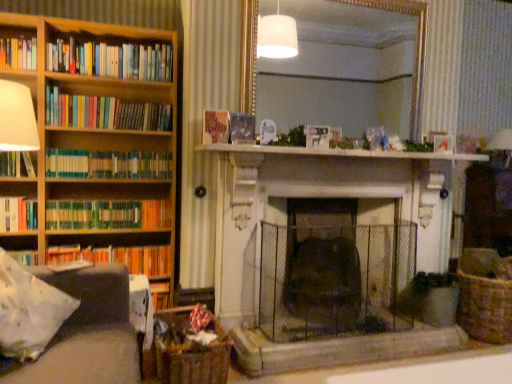
Question: Does wooden book at center, the 6th book in the bottom-to-top sequence, come in front of green matte bookshelf at left, placed as the fifth book when sorted from top to bottom?

Choices:
 (A) no
 (B) yes

Answer: (B)

Question: Does wooden book at center, the 6th book in the bottom-to-top sequence, have a greater width compared to green matte bookshelf at left, placed as the fifth book when sorted from top to bottom?

Choices:
 (A) no
 (B) yes

Answer: (A)

Question: From the image's perspective, is wooden book at center, acting as the 3th book starting from the top, beneath green matte bookshelf at left, placed as the fifth book when sorted from top to bottom?

Choices:
 (A) no
 (B) yes

Answer: (A)

Question: Is wooden book at center, acting as the 3th book starting from the top, with green matte bookshelf at left, placed as the fifth book when sorted from top to bottom?

Choices:
 (A) yes
 (B) no

Answer: (B)

Question: Is wooden book at center, the 6th book in the bottom-to-top sequence, outside of green matte bookshelf at left, placed as the fifth book when sorted from top to bottom?

Choices:
 (A) no
 (B) yes

Answer: (B)

Question: Is wooden book at center, acting as the 3th book starting from the top, far away from green matte bookshelf at left, arranged as the fourth book when ordered from the bottom?

Choices:
 (A) yes
 (B) no

Answer: (B)

Question: From the image's perspective, is green matte bookshelf at left, arranged as the fourth book when ordered from the bottom, located beneath hardcover book at left, the 8th book in the top-to-bottom sequence?

Choices:
 (A) yes
 (B) no

Answer: (B)

Question: Is the depth of green matte bookshelf at left, arranged as the fourth book when ordered from the bottom, greater than that of hardcover book at left, the first book when ordered from bottom to top?

Choices:
 (A) yes
 (B) no

Answer: (B)

Question: Are green matte bookshelf at left, arranged as the fourth book when ordered from the bottom, and hardcover book at left, the first book when ordered from bottom to top, far apart?

Choices:
 (A) no
 (B) yes

Answer: (A)

Question: Is green matte bookshelf at left, placed as the fifth book when sorted from top to bottom, turned away from hardcover book at left, the first book when ordered from bottom to top?

Choices:
 (A) no
 (B) yes

Answer: (A)

Question: Does green matte bookshelf at left, arranged as the fourth book when ordered from the bottom, appear on the left side of hardcover book at left, the 8th book in the top-to-bottom sequence?

Choices:
 (A) no
 (B) yes

Answer: (A)

Question: Does green matte bookshelf at left, arranged as the fourth book when ordered from the bottom, have a greater height compared to hardcover book at left, the first book when ordered from bottom to top?

Choices:
 (A) no
 (B) yes

Answer: (A)

Question: From the image's perspective, is wooden bookshelf at left on top of wooden book at center, acting as the 3th book starting from the top?

Choices:
 (A) yes
 (B) no

Answer: (B)